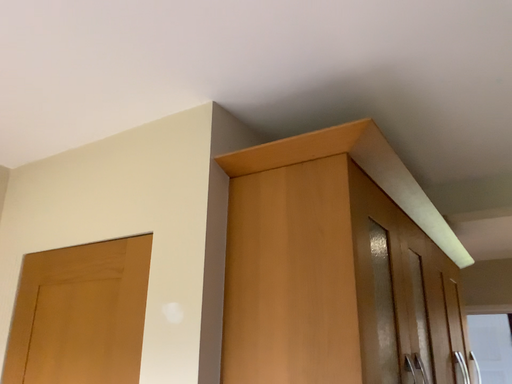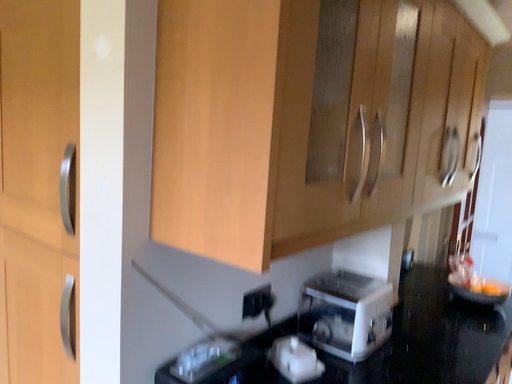
Question: Which way did the camera rotate in the video?

Choices:
 (A) rotated right
 (B) rotated left

Answer: (B)